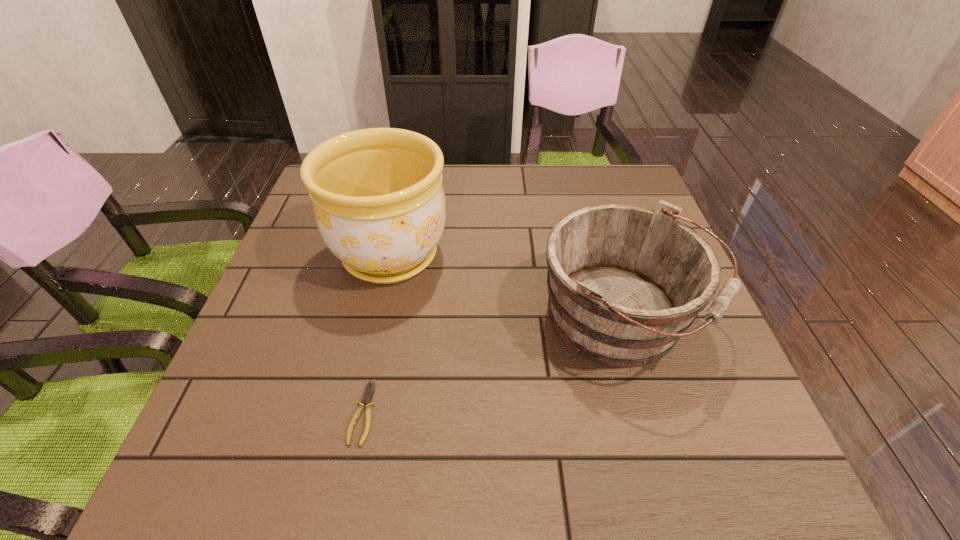
You are a GUI agent. You are given a task and a screenshot of the screen. Output one action in this format:
    pyautogui.click(x=<x>, y=<y>)
    Task: Click on the blank area in the image that satisfies the following two spatial constraints: 1. on the back side of the rightmost object; 2. on the left side of the pliers
    
    Given the screenshot: What is the action you would take?
    pyautogui.click(x=381, y=320)

What are the coordinates of `free region that satisfies the following two spatial constraints: 1. on the front side of the tallest object; 2. on the left side of the pliers` in the screenshot? It's located at (357, 413).